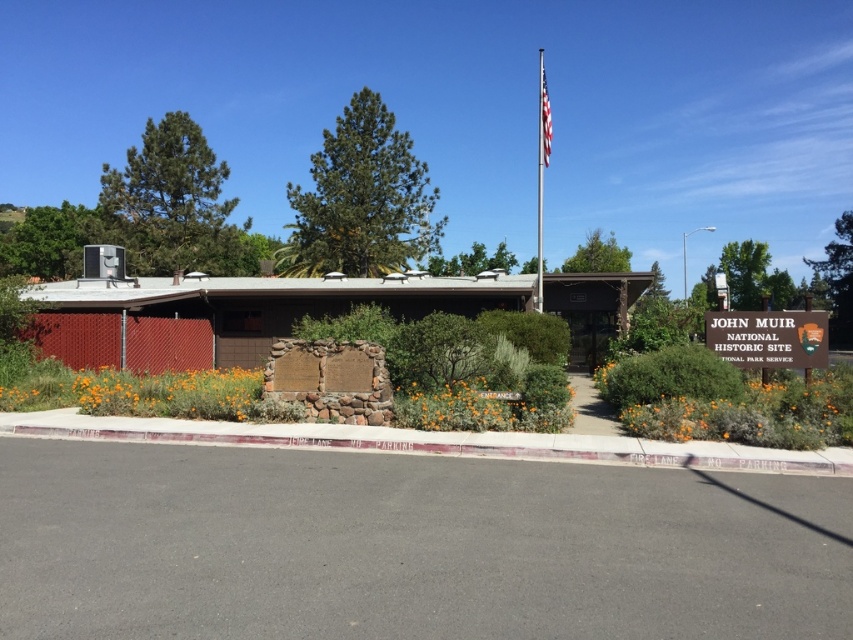
Who is taller, polished metal flag pole at upper center or american flag at upper center?

With more height is polished metal flag pole at upper center.

Can you confirm if polished metal flag pole at upper center is wider than american flag at upper center?

Yes.

Is point (546, 152) in front of point (546, 96)?

Yes, it is in front of point (546, 96).

You are a GUI agent. You are given a task and a screenshot of the screen. Output one action in this format:
    pyautogui.click(x=<x>, y=<y>)
    Task: Click on the polished metal flag pole at upper center
    Image resolution: width=853 pixels, height=640 pixels.
    Given the screenshot: What is the action you would take?
    pyautogui.click(x=541, y=166)

Is green wooden sign at center shorter than american flag at upper center?

Yes.

Does point (708, 332) come in front of point (550, 124)?

Yes, it is.

Find the location of `green wooden sign at center`. green wooden sign at center is located at coordinates (769, 337).

This screenshot has height=640, width=853. I want to click on green wooden sign at center, so click(x=769, y=337).

The image size is (853, 640). Find the location of `green wooden sign at center`. green wooden sign at center is located at coordinates (769, 337).